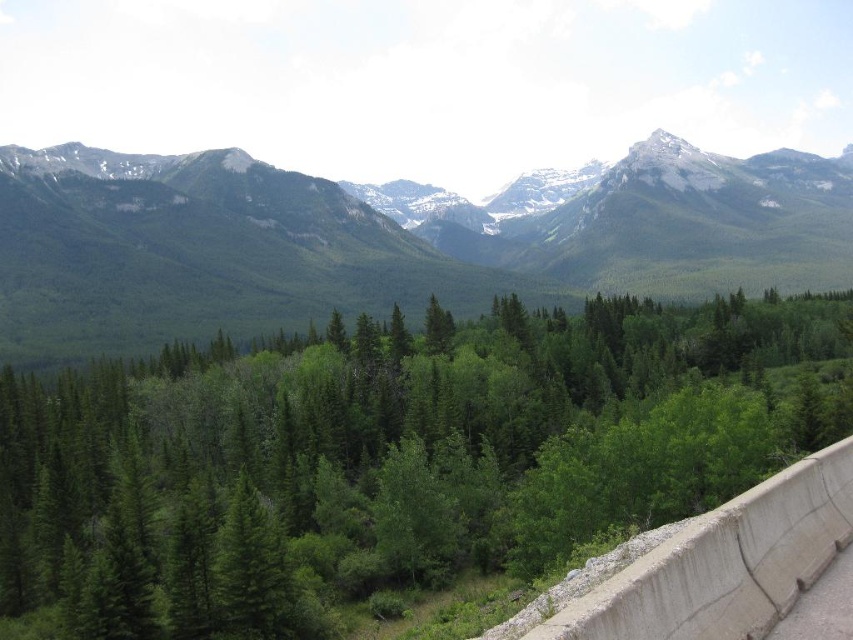
Looking at the scene, where is the green forested mountain range at center in relation to the gray concrete ledge at lower right?

The green forested mountain range at center is to the right of the gray concrete ledge at lower right.

You are standing at the base of the green forested mountain range at center and want to hike to the peak. If your average hiking pace is 3.5 km per hour, how long will it take you to reach the peak?

The question cannot be answered with the provided information because the distance to the peak and elevation details are not specified in the scene description or object details.